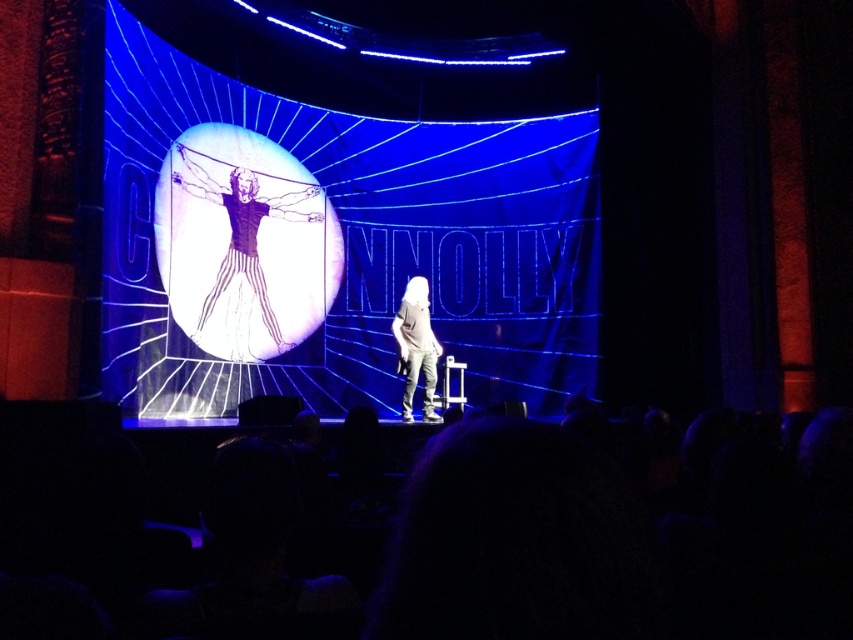
Which of these two, white matte screen at center or translucent white figure at center, stands taller?

Standing taller between the two is white matte screen at center.

Is white matte screen at center thinner than translucent white figure at center?

No.

Who is more forward, (355, 273) or (207, 317)?

Point (207, 317) is in front.

At what (x,y) coordinates should I click in order to perform the action: click on white matte screen at center. Please return your answer as a coordinate pair (x, y). This screenshot has width=853, height=640. Looking at the image, I should click on (334, 244).

Does translucent white figure at center come in front of white cotton shirt at center?

That is True.

Does point (236, 225) lie in front of point (432, 410)?

Yes.

Locate an element on the screen. translucent white figure at center is located at coordinates (244, 232).

Between white matte screen at center and white cotton shirt at center, which one is positioned higher?

white matte screen at center is higher up.

Can you confirm if white matte screen at center is positioned to the left of white cotton shirt at center?

Indeed, white matte screen at center is positioned on the left side of white cotton shirt at center.

Is point (575, 358) closer to camera compared to point (409, 320)?

No, (575, 358) is behind (409, 320).

Identify the location of white matte screen at center. The width and height of the screenshot is (853, 640). (334, 244).